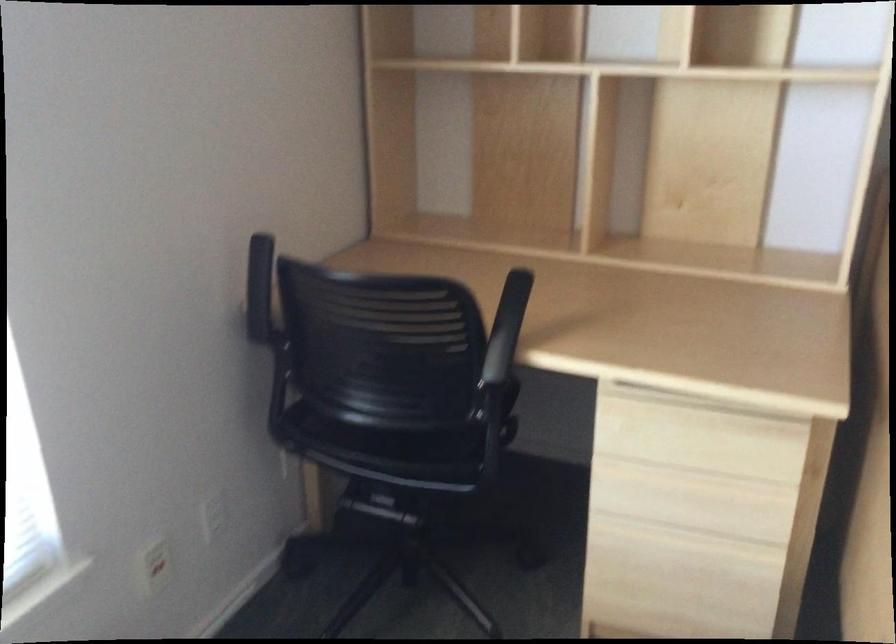
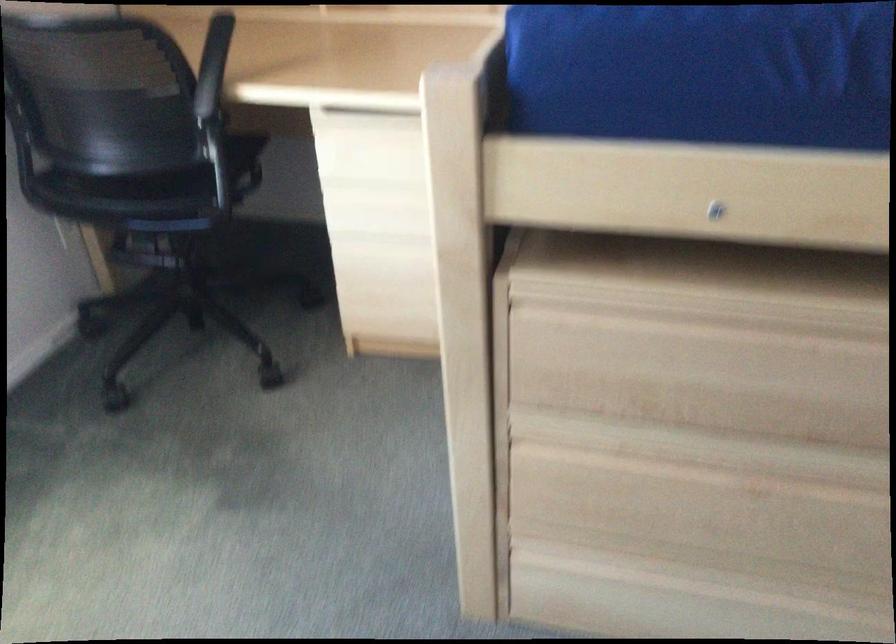
Locate, in the second image, the point that corresponds to the point at 506,332 in the first image.

(212, 66)